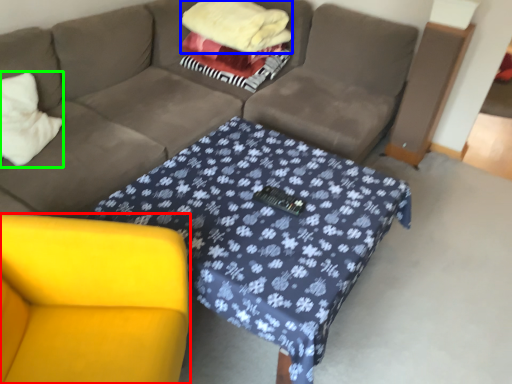
Question: Which object is positioned farthest from armchair (highlighted by a red box)? Select from blanket (highlighted by a blue box) and throw pillow (highlighted by a green box).

Choices:
 (A) blanket
 (B) throw pillow

Answer: (A)